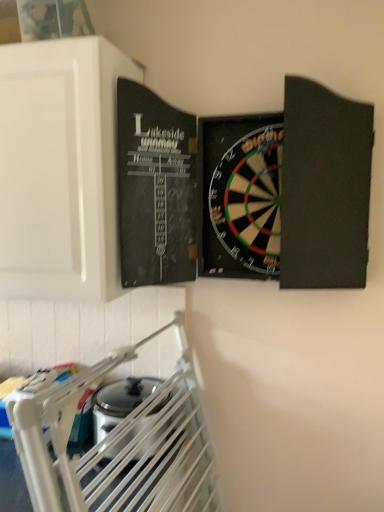
Question: Considering their positions, is white matte cabinet at upper left located in front of or behind satin silver toaster at lower left?

Choices:
 (A) front
 (B) behind

Answer: (A)

Question: In terms of height, does white matte cabinet at upper left look taller or shorter compared to satin silver toaster at lower left?

Choices:
 (A) tall
 (B) short

Answer: (A)

Question: Based on their positions, is white matte cabinet at upper left located to the left or right of satin silver toaster at lower left?

Choices:
 (A) right
 (B) left

Answer: (B)

Question: In terms of size, does satin silver toaster at lower left appear bigger or smaller than white matte cabinet at upper left?

Choices:
 (A) big
 (B) small

Answer: (B)

Question: From the image's perspective, is satin silver toaster at lower left positioned above or below white matte cabinet at upper left?

Choices:
 (A) below
 (B) above

Answer: (A)

Question: Looking at their shapes, would you say satin silver toaster at lower left is wider or thinner than white matte cabinet at upper left?

Choices:
 (A) thin
 (B) wide

Answer: (A)

Question: Choose the correct answer: Is satin silver toaster at lower left inside white matte cabinet at upper left or outside it?

Choices:
 (A) inside
 (B) outside

Answer: (B)